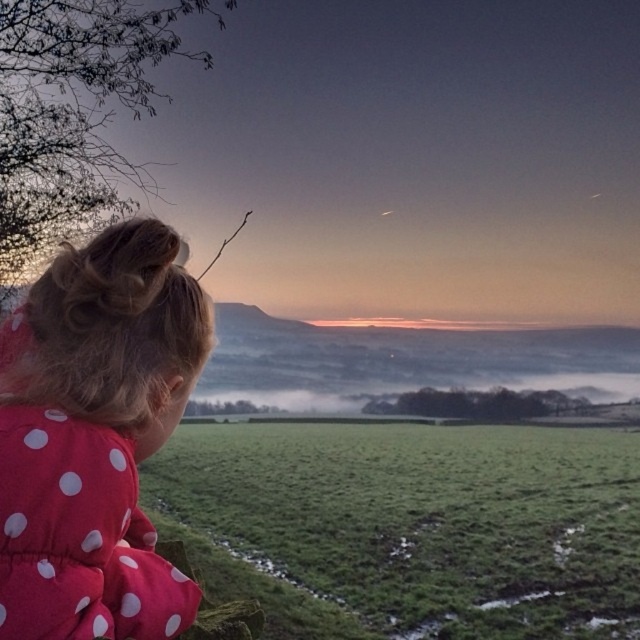
Based on the scene description, where is the green grassy field at lower center located in terms of its 2D coordinates?

The green grassy field at lower center is located at the 2D coordinates of point [420,522].